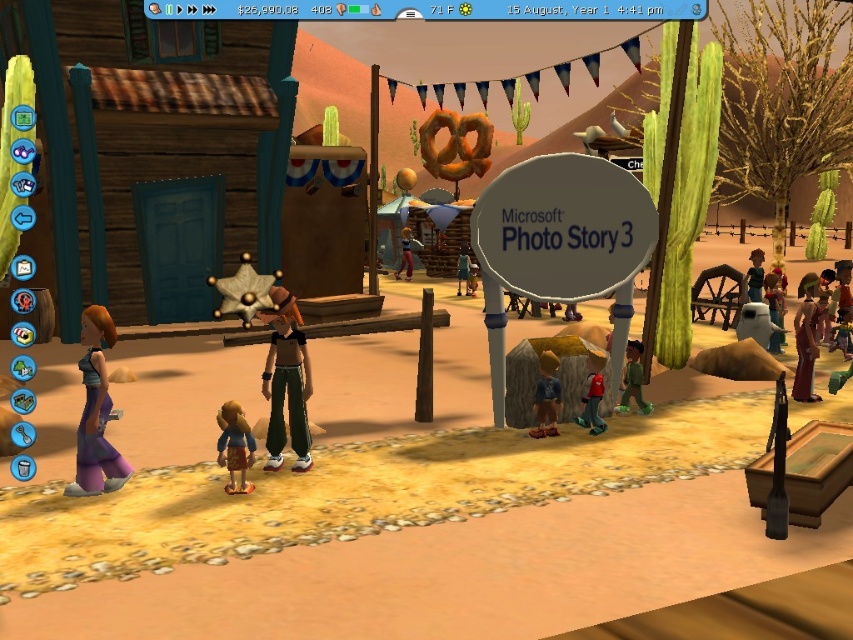
You are a character in the game who needs to pick up both the brown velvet dress at right and the brown leather jacket at right. If you start at the position where you are currently standing, which item should you move towards first to minimize the distance traveled?

The brown velvet dress at right is 9.42 feet away from the brown leather jacket at right. To minimize the distance traveled, you should pick up whichever item is closer to your starting position first. However, without knowing your exact starting location, it is impossible to determine which item is nearer.